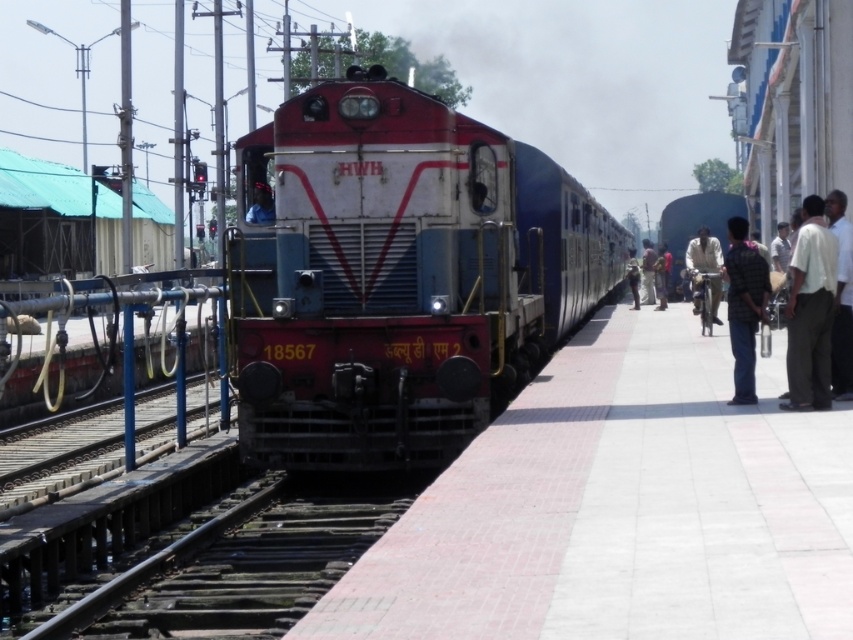
Question: Which point is closer to the camera?

Choices:
 (A) (733, 355)
 (B) (810, 220)

Answer: (B)

Question: Is white cotton shirt at right smaller than blue fabric shirt at center?

Choices:
 (A) no
 (B) yes

Answer: (A)

Question: Which is nearer to the dark blue jeans at right?

Choices:
 (A) plaid shirt at right
 (B) white cotton shirt at right
 (C) blue fabric shirt at center

Answer: (C)

Question: Is matte red locomotive at center to the right of white shirt at right from the viewer's perspective?

Choices:
 (A) no
 (B) yes

Answer: (A)

Question: Can you confirm if white shirt at right is positioned to the left of white matte shirt at center?

Choices:
 (A) no
 (B) yes

Answer: (B)

Question: Which object appears closest to the camera in this image?

Choices:
 (A) white matte shirt at center
 (B) matte red locomotive at center
 (C) white cotton shirt at right

Answer: (C)